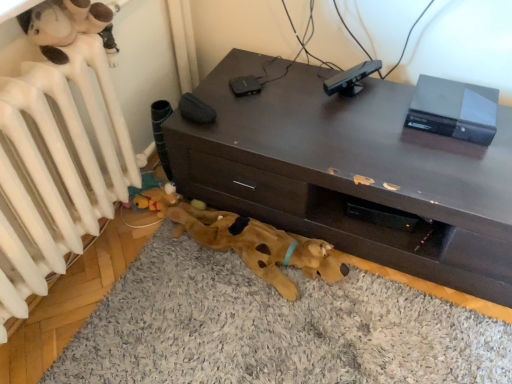
Where is `vacant area in front of brown plush dog at lower center`? Image resolution: width=512 pixels, height=384 pixels. vacant area in front of brown plush dog at lower center is located at coordinates pyautogui.click(x=246, y=332).